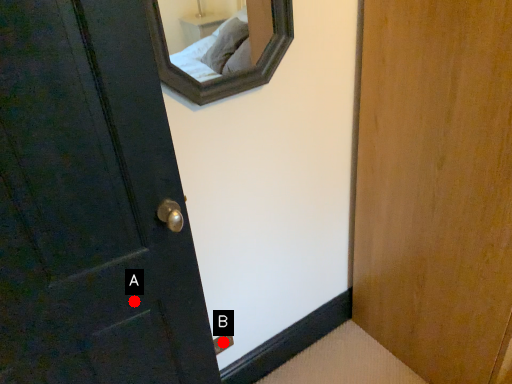
Question: Two points are circled on the image, labeled by A and B beside each circle. Which point is farther from the camera taking this photo?

Choices:
 (A) A is further
 (B) B is further

Answer: (B)